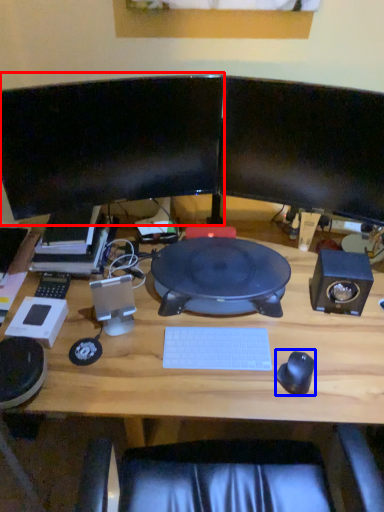
Question: Which of the following is the farthest to the observer, computer monitor (highlighted by a red box) or mouse (highlighted by a blue box)?

Choices:
 (A) computer monitor
 (B) mouse

Answer: (A)